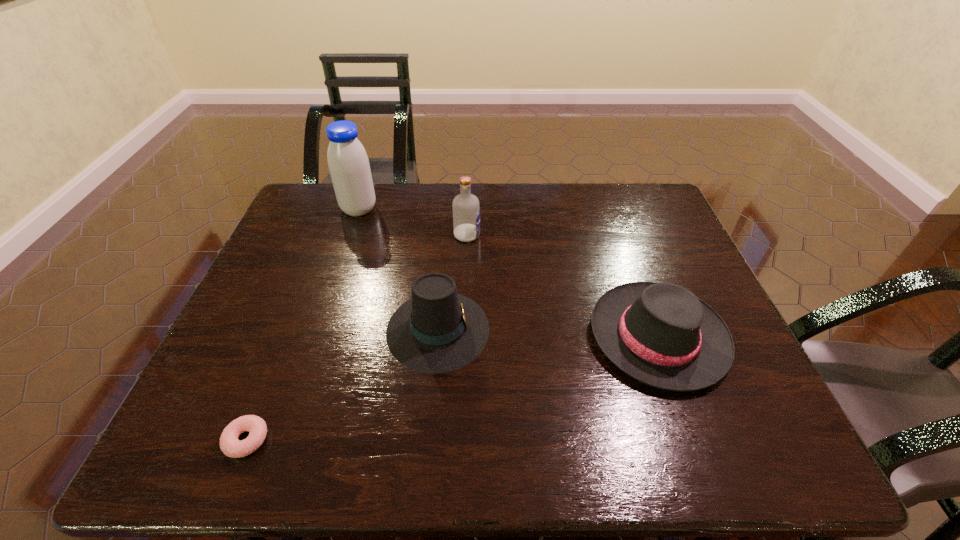
Where is `vacant space that satisfies the following two spatial constraints: 1. on the front-facing side of the taller dress hat; 2. on the right side of the shorter dress hat`? vacant space that satisfies the following two spatial constraints: 1. on the front-facing side of the taller dress hat; 2. on the right side of the shorter dress hat is located at coordinates (438, 336).

What are the coordinates of `free location that satisfies the following two spatial constraints: 1. on the label of the vodka; 2. on the left side of the right dress hat` in the screenshot? It's located at pyautogui.click(x=464, y=336).

You are a GUI agent. You are given a task and a screenshot of the screen. Output one action in this format:
    pyautogui.click(x=<x>, y=<y>)
    Task: Click on the free point that satisfies the following two spatial constraints: 1. on the front-facing side of the right dress hat; 2. on the right side of the third shortest object
    The image size is (960, 540).
    Given the screenshot: What is the action you would take?
    pyautogui.click(x=438, y=336)

You are a GUI agent. You are given a task and a screenshot of the screen. Output one action in this format:
    pyautogui.click(x=<x>, y=<y>)
    Task: Click on the free location that satisfies the following two spatial constraints: 1. on the back side of the nearest object; 2. on the left side of the shorter dress hat
    This screenshot has width=960, height=540.
    Given the screenshot: What is the action you would take?
    pyautogui.click(x=288, y=336)